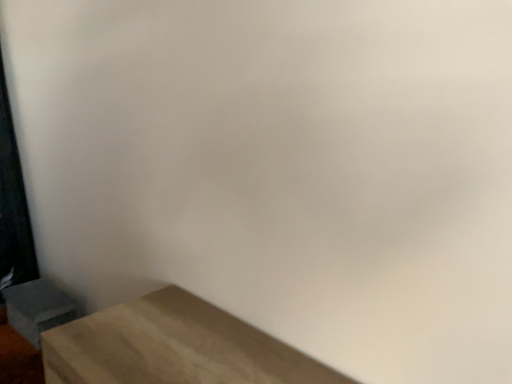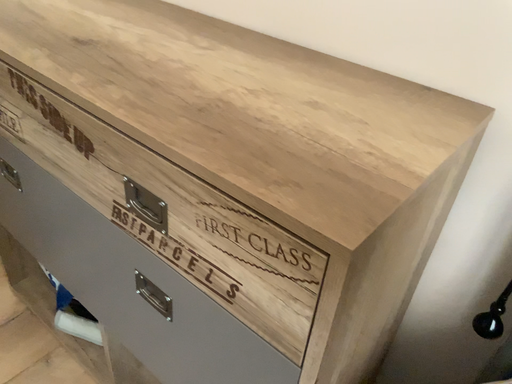
Question: Which way did the camera rotate in the video?

Choices:
 (A) rotated upward
 (B) rotated downward

Answer: (B)